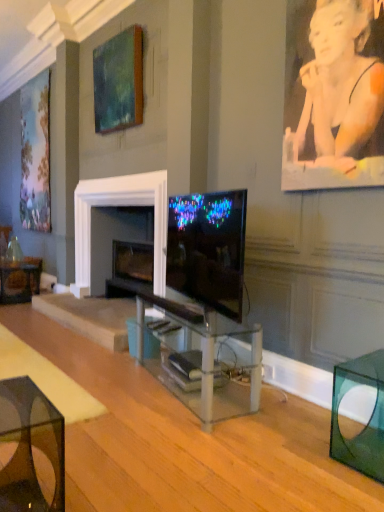
Where is `free space to the left of transparent glass cube at lower right, the third table from the back`? Image resolution: width=384 pixels, height=512 pixels. free space to the left of transparent glass cube at lower right, the third table from the back is located at coordinates (304, 470).